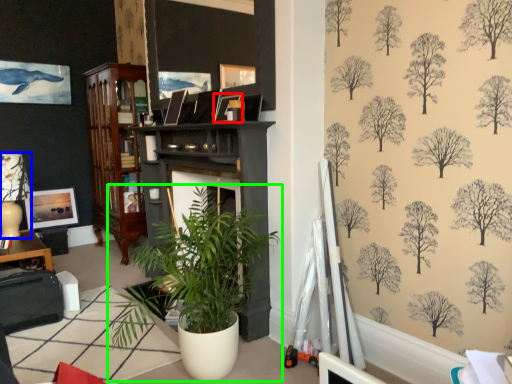
Question: Estimate the real-world distances between objects in this image. Which object is farther from picture frame (highlighted by a red box), lamp (highlighted by a blue box) or houseplant (highlighted by a green box)?

Choices:
 (A) lamp
 (B) houseplant

Answer: (A)